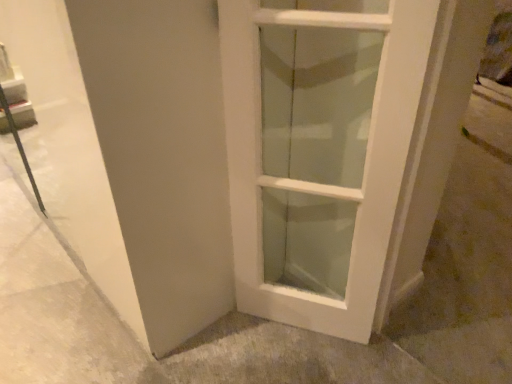
Where is `spots to the right of white matte door at center`? spots to the right of white matte door at center is located at coordinates (385, 353).